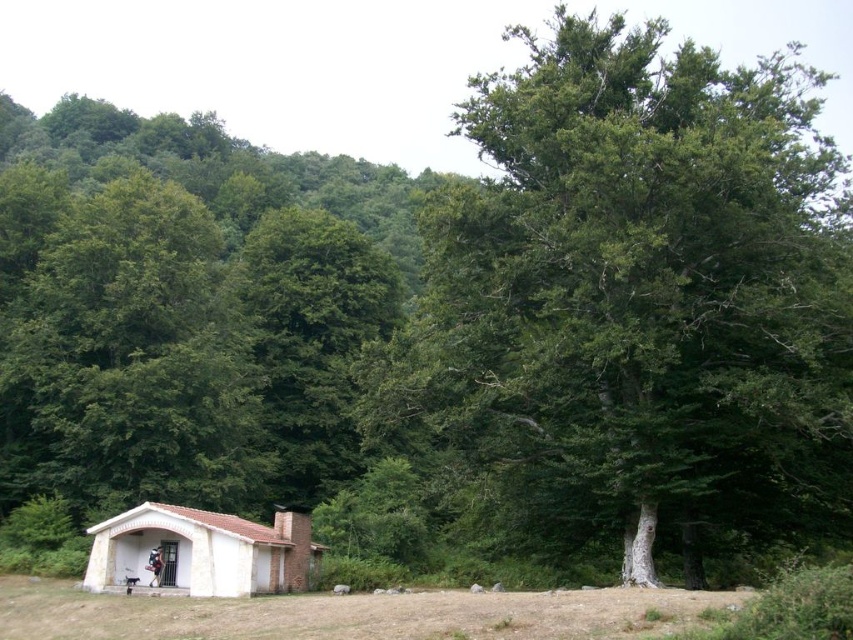
Question: Which of the following is the farthest from the observer?

Choices:
 (A) white brick hut at lower left
 (B) green leafy tree at center

Answer: (A)

Question: Does green leafy tree at center appear over white brick hut at lower left?

Choices:
 (A) no
 (B) yes

Answer: (B)

Question: Is green leafy tree at center positioned before white brick hut at lower left?

Choices:
 (A) no
 (B) yes

Answer: (B)

Question: Is the position of green leafy tree at center less distant than that of white brick hut at lower left?

Choices:
 (A) no
 (B) yes

Answer: (B)